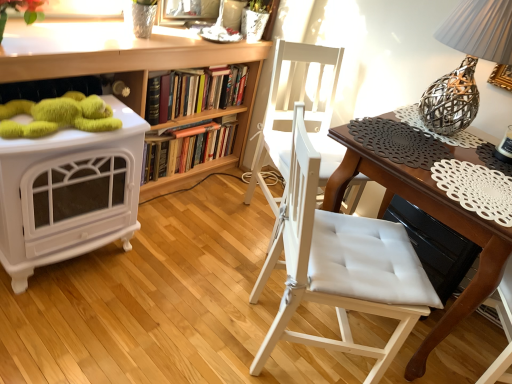
The height and width of the screenshot is (384, 512). Identify the location of white glossy fireplace at left. (68, 194).

Identify the location of hardcover book at center, which is counted as the second book, starting from the top. (186, 149).

The width and height of the screenshot is (512, 384). Find the location of `wooden table at center`. wooden table at center is located at coordinates (434, 217).

The image size is (512, 384). Describe the element at coordinates (130, 68) in the screenshot. I see `wooden bookcase at upper center` at that location.

Image resolution: width=512 pixels, height=384 pixels. Describe the element at coordinates (194, 92) in the screenshot. I see `hardcover books at center, arranged as the first book when viewed from the top` at that location.

The width and height of the screenshot is (512, 384). What do you see at coordinates (467, 62) in the screenshot?
I see `woven metallic lampshade at upper right` at bounding box center [467, 62].

The image size is (512, 384). What are the coordinates of `woven metallic lampshade at upper right` in the screenshot? It's located at (467, 62).

Find the location of a particular element. The height and width of the screenshot is (384, 512). white glossy fireplace at left is located at coordinates (68, 194).

Could you tell me if white padded chair at center, acting as the 1th chair starting from the back, is turned towards woven metallic lampshade at upper right?

No, white padded chair at center, acting as the 1th chair starting from the back, is not turned towards woven metallic lampshade at upper right.

Which of these two, white padded chair at center, the 2th chair positioned from the front, or woven metallic lampshade at upper right, is wider?

white padded chair at center, the 2th chair positioned from the front.

What's the angular difference between white padded chair at center, acting as the 1th chair starting from the back, and woven metallic lampshade at upper right's facing directions?

66.1 degrees.

Considering the sizes of objects white padded chair at center, the 2th chair positioned from the front, and woven metallic lampshade at upper right in the image provided, who is smaller, white padded chair at center, the 2th chair positioned from the front, or woven metallic lampshade at upper right?

With smaller size is woven metallic lampshade at upper right.

Image resolution: width=512 pixels, height=384 pixels. Find the location of `bookcase that appears above the hardcover book at center, which is the 1th book in bottom-to-top order (from the image's perspective)`. bookcase that appears above the hardcover book at center, which is the 1th book in bottom-to-top order (from the image's perspective) is located at coordinates [130, 68].

From the image's perspective, does wooden bookcase at upper center appear lower than hardcover book at center, which is the 1th book in bottom-to-top order?

Actually, wooden bookcase at upper center appears above hardcover book at center, which is the 1th book in bottom-to-top order, in the image.

How different are the orientations of wooden bookcase at upper center and hardcover book at center, which is counted as the second book, starting from the top, in degrees?

The facing directions of wooden bookcase at upper center and hardcover book at center, which is counted as the second book, starting from the top, are 0.000125 degrees apart.

From a real-world perspective, is wooden bookcase at upper center below hardcover book at center, which is the 1th book in bottom-to-top order?

No, from a real-world perspective, wooden bookcase at upper center is not under hardcover book at center, which is the 1th book in bottom-to-top order.

Between green fuzzy toy at upper left and hardcover book at center, which is counted as the second book, starting from the top, which one has smaller width?

hardcover book at center, which is counted as the second book, starting from the top.

In the image, is green fuzzy toy at upper left positioned in front of or behind hardcover book at center, which is counted as the second book, starting from the top?

green fuzzy toy at upper left is in front of hardcover book at center, which is counted as the second book, starting from the top.

Could you tell me if green fuzzy toy at upper left is facing hardcover book at center, which is the 1th book in bottom-to-top order?

No, green fuzzy toy at upper left is not facing towards hardcover book at center, which is the 1th book in bottom-to-top order.

In the image, is white padded chair at center, the 2th chair positioned from the front, on the left side or the right side of wooden table at center?

Clearly, white padded chair at center, the 2th chair positioned from the front, is on the left of wooden table at center in the image.

Is point (248, 187) closer or farther from the camera than point (490, 253)?

Clearly, point (248, 187) is more distant from the camera than point (490, 253).

Is wooden table at center surrounded by white padded chair at center, acting as the 1th chair starting from the back?

No, wooden table at center is located outside of white padded chair at center, acting as the 1th chair starting from the back.

Measure the distance between white padded chair at center, acting as the 1th chair starting from the back, and wooden table at center.

19.13 inches.

The image size is (512, 384). I want to click on toy above the hardcover books at center, arranged as the first book when viewed from the top (from a real-world perspective), so click(x=57, y=116).

Is there a large distance between hardcover books at center, the 2th book ordered from the bottom, and green fuzzy toy at upper left?

No.

In the scene shown: Is hardcover books at center, arranged as the first book when viewed from the top, to the right of green fuzzy toy at upper left from the viewer's perspective?

Correct, you'll find hardcover books at center, arranged as the first book when viewed from the top, to the right of green fuzzy toy at upper left.

From the image's perspective, would you say hardcover books at center, the 2th book ordered from the bottom, is shown under green fuzzy toy at upper left?

Incorrect, from the image's perspective, hardcover books at center, the 2th book ordered from the bottom, is higher than green fuzzy toy at upper left.

Which is closer to the camera, (206, 77) or (148, 75)?

Point (206, 77).

Does hardcover books at center, arranged as the first book when viewed from the top, have a greater width compared to wooden bookcase at upper center?

No, hardcover books at center, arranged as the first book when viewed from the top, is not wider than wooden bookcase at upper center.

Is hardcover books at center, arranged as the first book when viewed from the top, with wooden bookcase at upper center?

No, hardcover books at center, arranged as the first book when viewed from the top, is not in contact with wooden bookcase at upper center.

How far apart are hardcover books at center, the 2th book ordered from the bottom, and wooden bookcase at upper center?

hardcover books at center, the 2th book ordered from the bottom, and wooden bookcase at upper center are 6.71 inches apart from each other.

In the image, there is a white padded chair at center, positioned as the 1th chair in front-to-back order. Find the location of `table lamp above it (from the image's perspective)`. table lamp above it (from the image's perspective) is located at coordinates pyautogui.click(x=467, y=62).

Between white padded chair at center, positioned as the second chair in back-to-front order, and woven metallic lampshade at upper right, which one has smaller size?

With smaller size is woven metallic lampshade at upper right.

Which is more to the right, white padded chair at center, positioned as the 1th chair in front-to-back order, or woven metallic lampshade at upper right?

woven metallic lampshade at upper right is more to the right.

The width and height of the screenshot is (512, 384). What are the coordinates of `table lamp that appears in front of the white padded chair at center, acting as the 1th chair starting from the back` in the screenshot? It's located at (467, 62).

I want to click on bookcase above the hardcover book at center, which is counted as the second book, starting from the top (from a real-world perspective), so click(x=130, y=68).

Estimate the real-world distances between objects in this image. Which object is further from green fuzzy toy at upper left, hardcover book at center, which is counted as the second book, starting from the top, or white padded chair at center, positioned as the 1th chair in front-to-back order?

white padded chair at center, positioned as the 1th chair in front-to-back order, lies further to green fuzzy toy at upper left than the other object.

From the image, which object appears to be farther from wooden table at center, white glossy fireplace at left or wooden bookcase at upper center?

wooden bookcase at upper center lies further to wooden table at center than the other object.

From the image, which object appears to be nearer to white glossy fireplace at left, hardcover book at center, which is the 1th book in bottom-to-top order, or hardcover books at center, arranged as the first book when viewed from the top?

The object closer to white glossy fireplace at left is hardcover books at center, arranged as the first book when viewed from the top.

Looking at this image, from the image, which object appears to be farther from wooden table at center, white glossy fireplace at left or woven metallic lampshade at upper right?

white glossy fireplace at left is further to wooden table at center.

Looking at the image, which one is located closer to wooden bookcase at upper center, hardcover books at center, the 2th book ordered from the bottom, or woven metallic lampshade at upper right?

hardcover books at center, the 2th book ordered from the bottom, is positioned closer to the anchor wooden bookcase at upper center.

Looking at the image, which one is located closer to white padded chair at center, the 2th chair positioned from the front, wooden table at center or hardcover books at center, the 2th book ordered from the bottom?

Based on the image, hardcover books at center, the 2th book ordered from the bottom, appears to be nearer to white padded chair at center, the 2th chair positioned from the front.

Which object lies further to the anchor point hardcover books at center, the 2th book ordered from the bottom, hardcover book at center, which is the 1th book in bottom-to-top order, or wooden table at center?

The object further to hardcover books at center, the 2th book ordered from the bottom, is wooden table at center.

Estimate the real-world distances between objects in this image. Which object is closer to woven metallic lampshade at upper right, hardcover book at center, which is counted as the second book, starting from the top, or wooden bookcase at upper center?

Based on the image, wooden bookcase at upper center appears to be nearer to woven metallic lampshade at upper right.

Locate an element on the screen. The width and height of the screenshot is (512, 384). book between wooden bookcase at upper center and white padded chair at center, the 2th chair positioned from the front is located at coordinates (194, 92).

The width and height of the screenshot is (512, 384). Find the location of `bookcase between white glossy fireplace at left and hardcover books at center, the 2th book ordered from the bottom, in the front-back direction`. bookcase between white glossy fireplace at left and hardcover books at center, the 2th book ordered from the bottom, in the front-back direction is located at coordinates (130, 68).

Find the location of `bookcase between white glossy fireplace at left and hardcover book at center, which is the 1th book in bottom-to-top order, along the z-axis`. bookcase between white glossy fireplace at left and hardcover book at center, which is the 1th book in bottom-to-top order, along the z-axis is located at coordinates (130, 68).

The width and height of the screenshot is (512, 384). I want to click on chair positioned between white padded chair at center, positioned as the 1th chair in front-to-back order, and hardcover book at center, which is counted as the second book, starting from the top, from near to far, so click(292, 112).